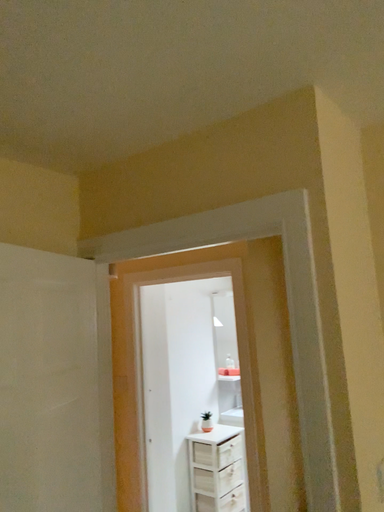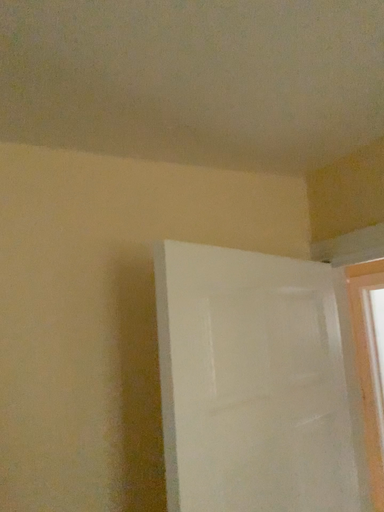
Question: How did the camera likely rotate when shooting the video?

Choices:
 (A) rotated right
 (B) rotated left

Answer: (B)